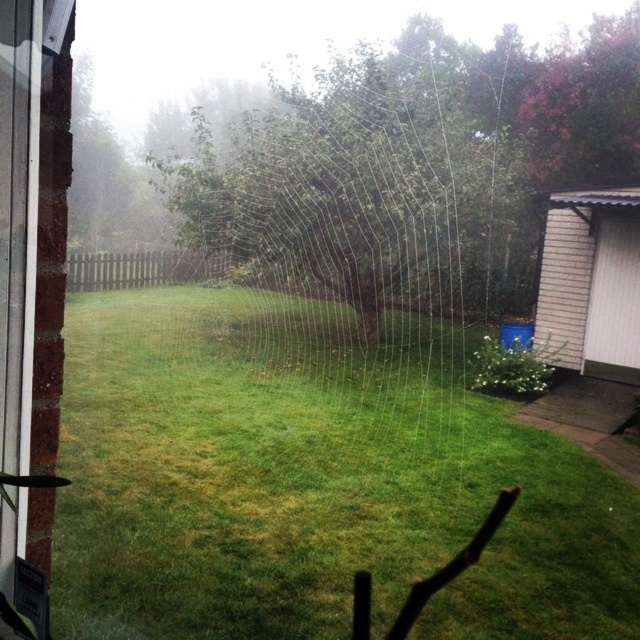
Question: In this image, where is green grass at center located relative to clear glass window at left?

Choices:
 (A) left
 (B) right

Answer: (B)

Question: Among these objects, which one is nearest to the camera?

Choices:
 (A) white plastic screen door at right
 (B) transparent silk spider web at center

Answer: (B)

Question: Which point is farther to the camera?

Choices:
 (A) (3, 100)
 (B) (600, 227)
 (C) (144, 426)

Answer: (B)

Question: Is green grass at center above transparent silk spider web at center?

Choices:
 (A) no
 (B) yes

Answer: (A)

Question: Which of these objects is positioned closest to the clear glass window at left?

Choices:
 (A) green grass at center
 (B) transparent silk spider web at center
 (C) white plastic screen door at right

Answer: (A)

Question: Does green grass at center appear on the left side of white plastic screen door at right?

Choices:
 (A) no
 (B) yes

Answer: (B)